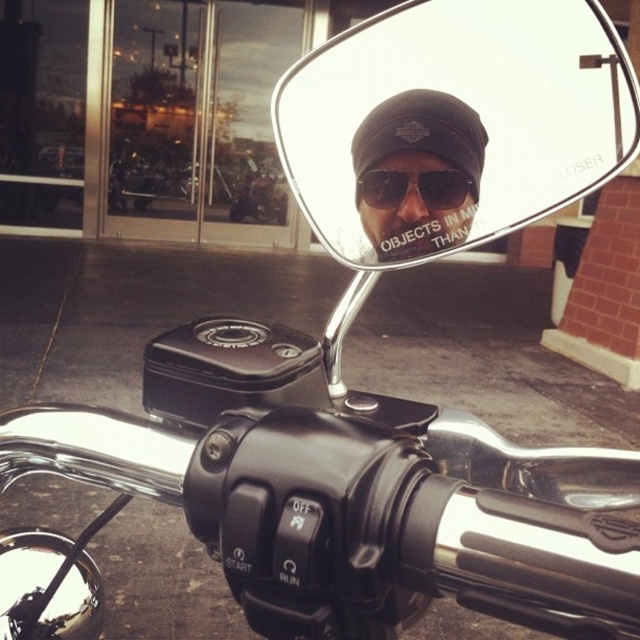
Question: Which point is farther to the camera?

Choices:
 (A) (435, 33)
 (B) (451, 177)

Answer: (A)

Question: Can you confirm if black reflective mirror at upper center is positioned below black matte sunglasses at center?

Choices:
 (A) no
 (B) yes

Answer: (A)

Question: Observing the image, what is the correct spatial positioning of black reflective mirror at upper center in reference to black matte sunglasses at center?

Choices:
 (A) above
 (B) below

Answer: (A)

Question: Which object appears closest to the camera in this image?

Choices:
 (A) black matte sunglasses at center
 (B) black reflective mirror at upper center

Answer: (B)

Question: From the image, what is the correct spatial relationship of black reflective mirror at upper center in relation to black matte sunglasses at center?

Choices:
 (A) right
 (B) left

Answer: (A)

Question: Which point is farther from the camera taking this photo?

Choices:
 (A) (365, 120)
 (B) (458, 122)

Answer: (A)